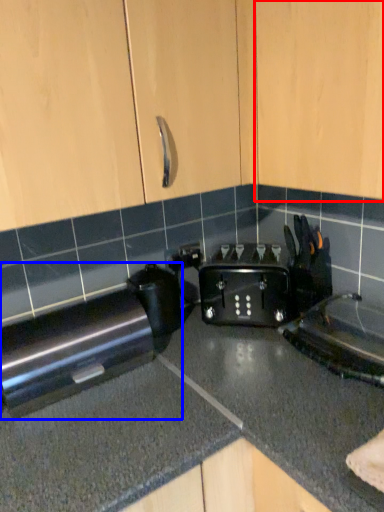
Question: Among these objects, which one is farthest to the camera, cabinetry (highlighted by a red box) or home appliance (highlighted by a blue box)?

Choices:
 (A) cabinetry
 (B) home appliance

Answer: (B)